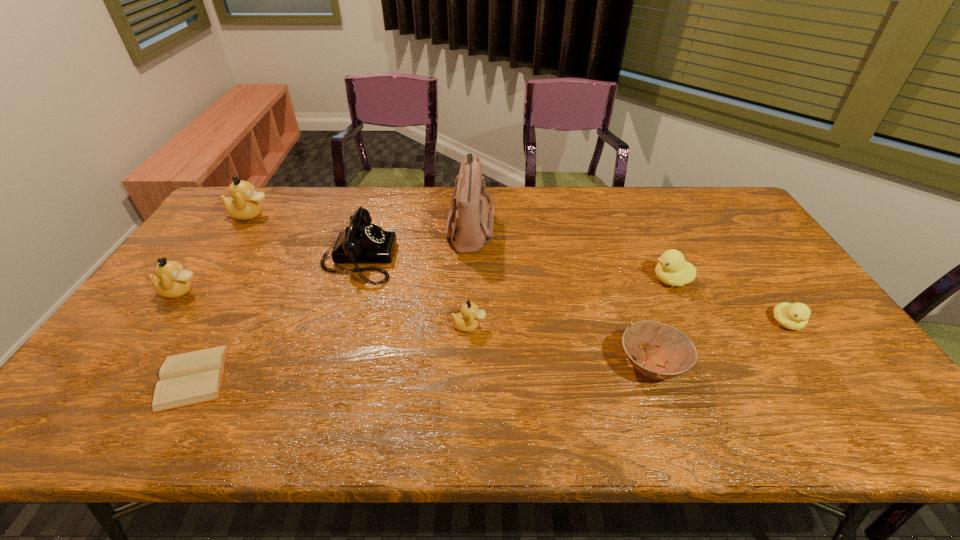
Locate an element on the screen. object that is at the right edge is located at coordinates (795, 316).

Image resolution: width=960 pixels, height=540 pixels. I want to click on object that is at the far left corner, so click(x=243, y=204).

Where is `object that is at the near left corner`? Image resolution: width=960 pixels, height=540 pixels. object that is at the near left corner is located at coordinates (193, 377).

Locate an element on the screen. Image resolution: width=960 pixels, height=540 pixels. vacant space at the far edge of the desktop is located at coordinates pyautogui.click(x=378, y=186).

This screenshot has width=960, height=540. In order to click on free space at the near edge in this screenshot , I will do `click(282, 428)`.

The width and height of the screenshot is (960, 540). In the image, there is a desktop. Identify the location of vacant area at the left edge. (200, 256).

In the image, there is a desktop. In order to click on vacant space at the right edge in this screenshot , I will do `click(750, 227)`.

Find the location of a particular element. The height and width of the screenshot is (540, 960). vacant region at the far left corner of the desktop is located at coordinates (276, 189).

Locate an element on the screen. blank space at the far right corner of the desktop is located at coordinates (728, 192).

Identify the location of vacant space at the near right corner of the desktop. pos(829,401).